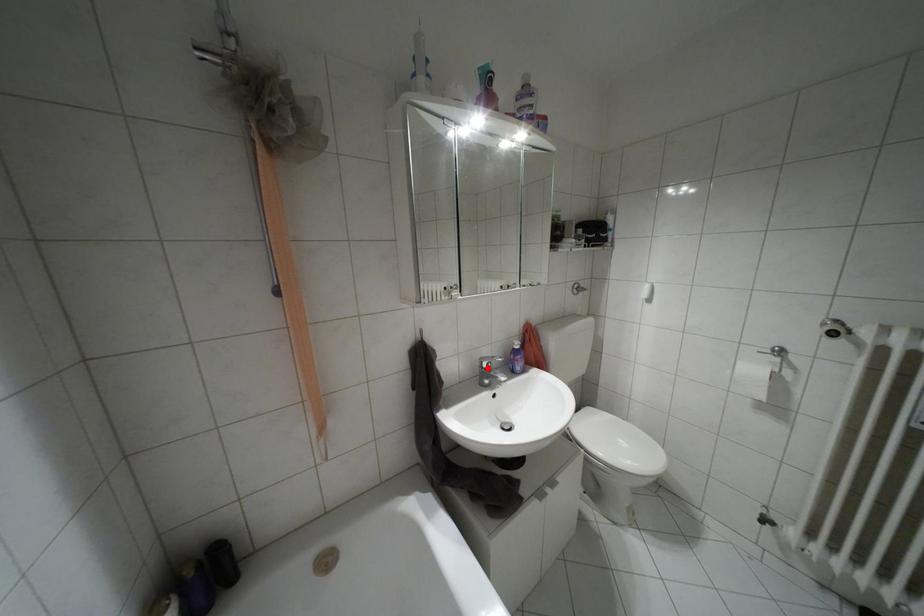
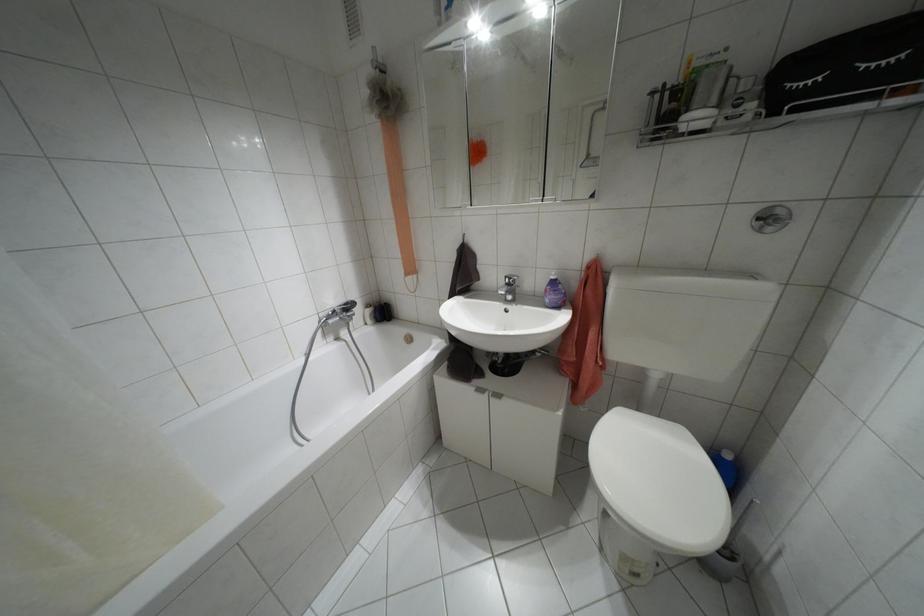
Find the pixel in the second image that matches the highlighted location in the first image.

(507, 284)